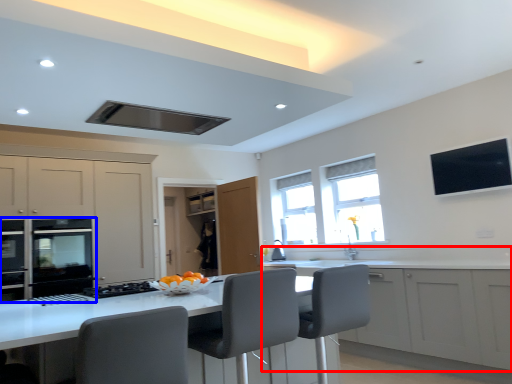
Question: Which object is further to the camera taking this photo, cabinetry (highlighted by a red box) or home appliance (highlighted by a blue box)?

Choices:
 (A) cabinetry
 (B) home appliance

Answer: (B)